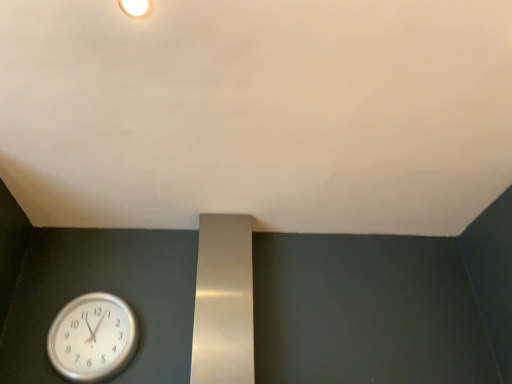
Question: Is white matte wall at upper center at the right side of silver metallic clock at lower left?

Choices:
 (A) no
 (B) yes

Answer: (B)

Question: From the image's perspective, would you say white matte wall at upper center is shown under silver metallic clock at lower left?

Choices:
 (A) no
 (B) yes

Answer: (A)

Question: Is silver metallic clock at lower left inside white matte wall at upper center?

Choices:
 (A) no
 (B) yes

Answer: (A)

Question: Does white matte wall at upper center turn towards silver metallic clock at lower left?

Choices:
 (A) no
 (B) yes

Answer: (A)

Question: From a real-world perspective, is white matte wall at upper center under silver metallic clock at lower left?

Choices:
 (A) yes
 (B) no

Answer: (B)

Question: Can you confirm if white matte wall at upper center is positioned to the left of silver metallic clock at lower left?

Choices:
 (A) yes
 (B) no

Answer: (B)

Question: From the image's perspective, is silver metallic clock at lower left under white matte light fixture at upper center?

Choices:
 (A) yes
 (B) no

Answer: (A)

Question: Does silver metallic clock at lower left come in front of white matte light fixture at upper center?

Choices:
 (A) yes
 (B) no

Answer: (B)

Question: Does silver metallic clock at lower left appear on the right side of white matte light fixture at upper center?

Choices:
 (A) yes
 (B) no

Answer: (B)

Question: Is silver metallic clock at lower left positioned far away from white matte light fixture at upper center?

Choices:
 (A) yes
 (B) no

Answer: (A)

Question: Considering the relative sizes of silver metallic clock at lower left and white matte light fixture at upper center in the image provided, is silver metallic clock at lower left bigger than white matte light fixture at upper center?

Choices:
 (A) yes
 (B) no

Answer: (A)

Question: Does silver metallic clock at lower left lie behind white matte light fixture at upper center?

Choices:
 (A) no
 (B) yes

Answer: (B)

Question: Is white matte light fixture at upper center oriented towards silver metallic clock at lower left?

Choices:
 (A) no
 (B) yes

Answer: (A)